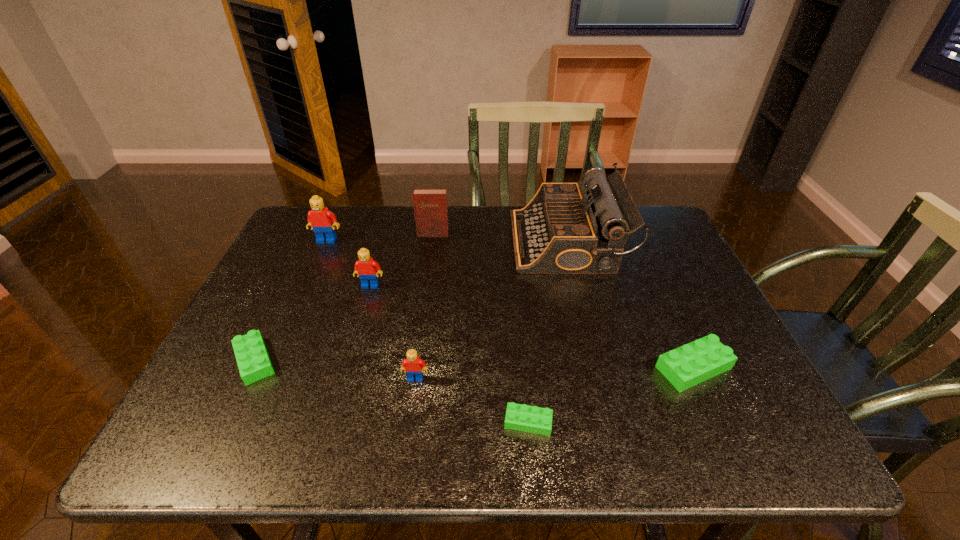
Select which red Lego is the second closest to the second biggest green Lego. Please provide its 2D coordinates. Your answer should be formatted as a tuple, i.e. [(x, y)], where the tuple contains the x and y coordinates of a point satisfying the conditions above.

[(414, 367)]

Locate an element on the screen. This screenshot has width=960, height=540. the closest red Lego to the leftmost red Lego is located at coordinates (367, 269).

Choose which green Lego is the nearest neighbor to the nearest green Lego. Please provide its 2D coordinates. Your answer should be formatted as a tuple, i.e. [(x, y)], where the tuple contains the x and y coordinates of a point satisfying the conditions above.

[(684, 367)]

Locate which green Lego is the closest to the reddish-brown diary. Please provide its 2D coordinates. Your answer should be formatted as a tuple, i.e. [(x, y)], where the tuple contains the x and y coordinates of a point satisfying the conditions above.

[(254, 364)]

I want to click on free space in the image that satisfies the following two spatial constraints: 1. on the keyboard of the tallest object; 2. on the face of the fifth nearest object, so click(577, 285).

You are a GUI agent. You are given a task and a screenshot of the screen. Output one action in this format:
    pyautogui.click(x=<x>, y=<y>)
    Task: Click on the vacant space that satisfies the following two spatial constraints: 1. on the face of the nearest green Lego; 2. on the right side of the fifth shortest Lego
    This screenshot has width=960, height=540.
    Given the screenshot: What is the action you would take?
    pyautogui.click(x=332, y=422)

At what (x,y) coordinates should I click in order to perform the action: click on free region that satisfies the following two spatial constraints: 1. on the face of the fifth shortest object; 2. on the left side of the rightmost Lego. Please return your answer as a coordinate pair (x, y). Image resolution: width=960 pixels, height=540 pixels. Looking at the image, I should click on (348, 368).

You are a GUI agent. You are given a task and a screenshot of the screen. Output one action in this format:
    pyautogui.click(x=<x>, y=<y>)
    Task: Click on the vacant space that satisfies the following two spatial constraints: 1. on the front cover of the nearest green Lego; 2. on the right side of the reddish-brown diary
    
    Given the screenshot: What is the action you would take?
    pyautogui.click(x=407, y=422)

I want to click on free location that satisfies the following two spatial constraints: 1. on the keyboard of the tallest object; 2. on the left side of the biggest green Lego, so click(597, 368).